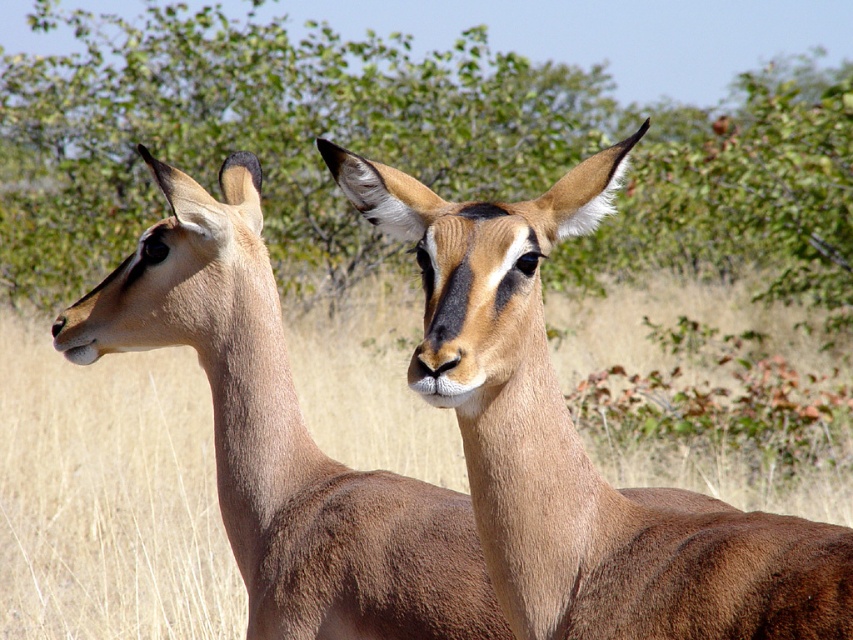
You are an animal photographer planning to take a portrait of the two antelopes in the image. You want to ensure the green leafy tree at upper center is visible in the background but not too close to the antelopes. Given that the antelopes are 10 feet away from you, will the tree be far enough to appear naturally in the background without being too prominent?

The green leafy tree at upper center is 39.30 feet from the viewer. Since the antelopes are only 10 feet away, the tree is significantly farther back, which means it will naturally appear smaller and less prominent in the background of the portrait.

Consider the image. You are a photographer trying to capture a landscape photo that includes both the green leafy tree at upper center and the brown fur antelope at center. Since you want the tree to be the main focus, which object should you position closer to the front of the frame?

To ensure the green leafy tree at upper center is the main focus, position the brown fur antelope at center closer to the front of the frame. This way, the tree will appear larger in the background, while the antelope remains visible but secondary in the composition.

You are a wildlife photographer aiming to capture a photo of both the brown smooth antelope at center and the brown fur antelope at center. Since you want to highlight their height difference, which antelope should you position closer to the camera to emphasize their size difference?

To emphasize the height difference between the brown smooth antelope at center and the brown fur antelope at center, position the brown smooth antelope at center closer to the camera since it is shorter than the brown fur antelope at center. This perspective will make the shorter antelope appear larger in comparison, visually highlighting their size difference.